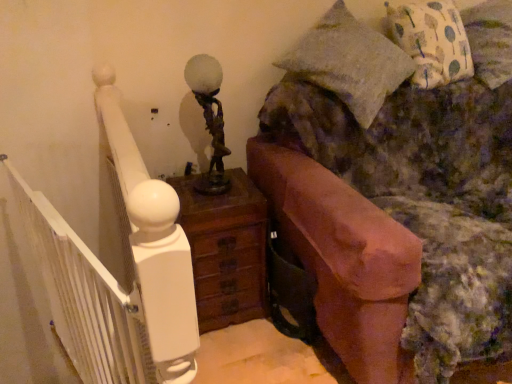
Describe the element at coordinates (209, 119) in the screenshot. I see `bronze/antique brass table lamp at center` at that location.

Identify the location of white painted wood balustrade at left. The height and width of the screenshot is (384, 512). (86, 300).

This screenshot has height=384, width=512. Describe the element at coordinates (490, 40) in the screenshot. I see `printed fabric pillow at upper right` at that location.

In order to click on terracotta clay fireplace at right in this screenshot , I will do `click(392, 202)`.

Does white painted wood balustrade at left have a lesser height compared to printed fabric pillow at upper right?

In fact, white painted wood balustrade at left may be taller than printed fabric pillow at upper right.

Would you consider white painted wood balustrade at left to be distant from printed fabric pillow at upper right?

white painted wood balustrade at left is far away from printed fabric pillow at upper right.

From the image's perspective, which one is positioned lower, white painted wood balustrade at left or printed fabric pillow at upper right?

white painted wood balustrade at left, from the image's perspective.

How different are the orientations of bronze/antique brass table lamp at center and white painted wood balustrade at left in degrees?

The angular difference between bronze/antique brass table lamp at center and white painted wood balustrade at left is 72.4 degrees.

Does point (215, 114) come closer to viewer compared to point (104, 375)?

No, (215, 114) is further to viewer.

The height and width of the screenshot is (384, 512). Identify the location of table lamp behind the white painted wood balustrade at left. (209, 119).

Based on their sizes in the image, would you say bronze/antique brass table lamp at center is bigger or smaller than white painted wood balustrade at left?

Considering their sizes, bronze/antique brass table lamp at center takes up less space than white painted wood balustrade at left.

Considering the relative sizes of terracotta clay fireplace at right and printed fabric pillow at upper right in the image provided, is terracotta clay fireplace at right bigger than printed fabric pillow at upper right?

Yes.

Is terracotta clay fireplace at right not within printed fabric pillow at upper right?

Indeed, terracotta clay fireplace at right is completely outside printed fabric pillow at upper right.

Is point (341, 86) farther from viewer compared to point (498, 9)?

No.

From a real-world perspective, between printed fabric pillow at upper right and brown wooden nightstand at center, who is vertically lower?

brown wooden nightstand at center, from a real-world perspective.

Considering the sizes of objects printed fabric pillow at upper right and brown wooden nightstand at center in the image provided, who is thinner, printed fabric pillow at upper right or brown wooden nightstand at center?

brown wooden nightstand at center is thinner.

From the image's perspective, between printed fabric pillow at upper right and brown wooden nightstand at center, who is located below?

brown wooden nightstand at center.

How much distance is there between printed fabric pillow at upper right and brown wooden nightstand at center?

A distance of 4.11 feet exists between printed fabric pillow at upper right and brown wooden nightstand at center.

Does terracotta clay fireplace at right contain brown wooden nightstand at center?

Actually, brown wooden nightstand at center is outside terracotta clay fireplace at right.

From a real-world perspective, who is located higher, terracotta clay fireplace at right or brown wooden nightstand at center?

terracotta clay fireplace at right.

Consider the image. Between terracotta clay fireplace at right and brown wooden nightstand at center, which one has smaller size?

brown wooden nightstand at center.

Which object is positioned more to the left, terracotta clay fireplace at right or brown wooden nightstand at center?

brown wooden nightstand at center.

Is bronze/antique brass table lamp at center bigger than printed fabric pillow at upper right?

No.

Considering the relative sizes of bronze/antique brass table lamp at center and printed fabric pillow at upper right in the image provided, is bronze/antique brass table lamp at center wider than printed fabric pillow at upper right?

No, bronze/antique brass table lamp at center is not wider than printed fabric pillow at upper right.

From the image's perspective, is bronze/antique brass table lamp at center located above or below printed fabric pillow at upper right?

bronze/antique brass table lamp at center is below printed fabric pillow at upper right.

Is brown wooden nightstand at center with bronze/antique brass table lamp at center?

There is a gap between brown wooden nightstand at center and bronze/antique brass table lamp at center.

Is the position of brown wooden nightstand at center less distant than that of bronze/antique brass table lamp at center?

No.

Looking at this image, is brown wooden nightstand at center positioned beyond the bounds of bronze/antique brass table lamp at center?

Absolutely, brown wooden nightstand at center is external to bronze/antique brass table lamp at center.

Between point (236, 250) and point (215, 118), which one is positioned behind?

Point (236, 250)

Locate an element on the screen. balustrade beneath the printed fabric pillow at upper right (from a real-world perspective) is located at coordinates (86, 300).

Identify the location of balustrade on the left of bronze/antique brass table lamp at center. Image resolution: width=512 pixels, height=384 pixels. tap(86, 300).

Estimate the real-world distances between objects in this image. Which object is further from bronze/antique brass table lamp at center, printed fabric pillow at upper right or brown wooden nightstand at center?

The object further to bronze/antique brass table lamp at center is printed fabric pillow at upper right.

Based on their spatial positions, is brown wooden nightstand at center or terracotta clay fireplace at right closer to white painted wood balustrade at left?

brown wooden nightstand at center is positioned closer to the anchor white painted wood balustrade at left.

When comparing their distances from white painted wood balustrade at left, does printed fabric pillow at upper right or bronze/antique brass table lamp at center seem further?

printed fabric pillow at upper right.

Which object lies nearer to the anchor point white painted wood balustrade at left, bronze/antique brass table lamp at center or brown wooden nightstand at center?

brown wooden nightstand at center is positioned closer to the anchor white painted wood balustrade at left.

Considering their positions, is printed fabric pillow at upper right positioned further to white painted wood balustrade at left than brown wooden nightstand at center?

The object further to white painted wood balustrade at left is printed fabric pillow at upper right.

Estimate the real-world distances between objects in this image. Which object is closer to white painted wood balustrade at left, bronze/antique brass table lamp at center or terracotta clay fireplace at right?

Among the two, bronze/antique brass table lamp at center is located nearer to white painted wood balustrade at left.

Which object lies further to the anchor point printed fabric pillow at upper right, white painted wood balustrade at left or terracotta clay fireplace at right?

Among the two, white painted wood balustrade at left is located further to printed fabric pillow at upper right.

Based on their spatial positions, is white painted wood balustrade at left or printed fabric pillow at upper right closer to brown wooden nightstand at center?

white painted wood balustrade at left lies closer to brown wooden nightstand at center than the other object.

The width and height of the screenshot is (512, 384). Identify the location of table lamp between white painted wood balustrade at left and printed fabric pillow at upper right. (209, 119).

You are a GUI agent. You are given a task and a screenshot of the screen. Output one action in this format:
    pyautogui.click(x=<x>, y=<y>)
    Task: Click on the table lamp between white painted wood balustrade at left and terracotta clay fireplace at right in the horizontal direction
    
    Given the screenshot: What is the action you would take?
    coord(209,119)

The height and width of the screenshot is (384, 512). Identify the location of nightstand between bronze/antique brass table lamp at center and terracotta clay fireplace at right from left to right. (226, 249).

Find the location of `nightstand between white painted wood balustrade at left and printed fabric pillow at upper right from left to right`. nightstand between white painted wood balustrade at left and printed fabric pillow at upper right from left to right is located at coordinates (226, 249).